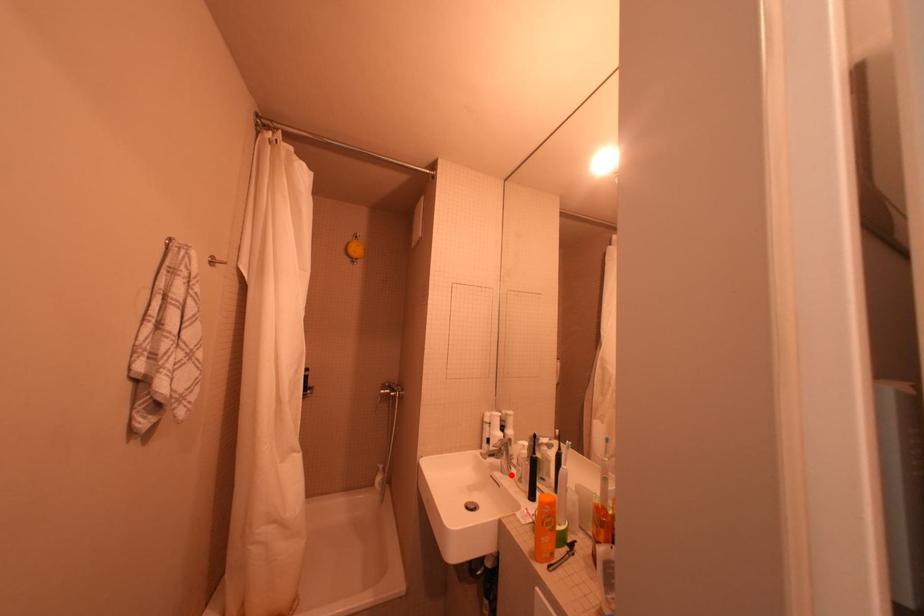
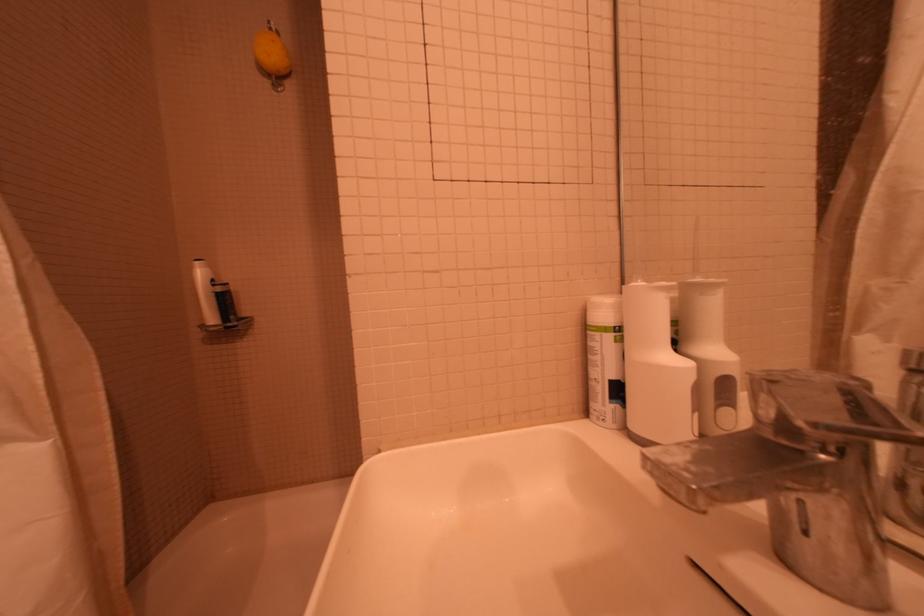
Question: I am providing you with two images of the same scene from different viewpoints. Image1 has a red point marked. In image2, the corresponding 3D location appears at what relative position? Reply with the corresponding letter.

Choices:
 (A) Closer
 (B) Farther

Answer: (A)